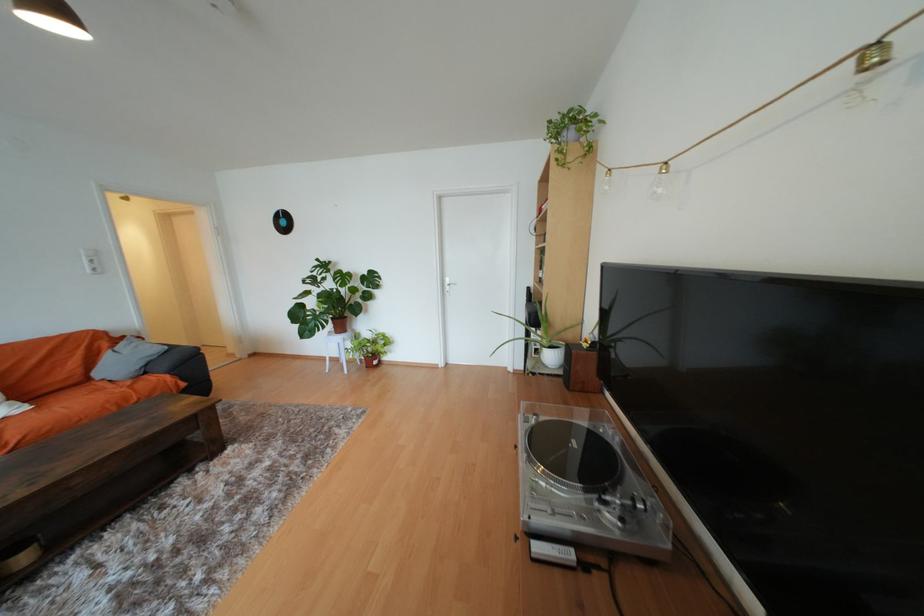
Find where to lift the white plant pot. Please return your answer as a coordinate pair (x, y).

(552, 354)